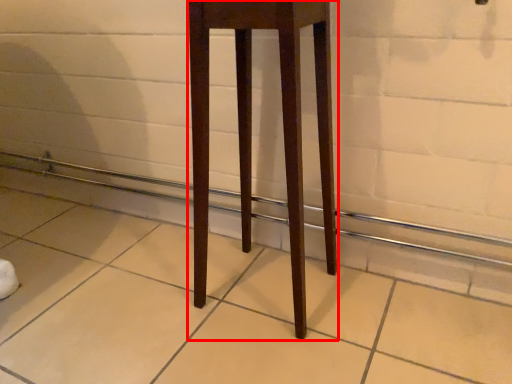
Question: From the image's perspective, where is furniture (annotated by the red box) located in relation to balustrade in the image?

Choices:
 (A) above
 (B) below

Answer: (A)